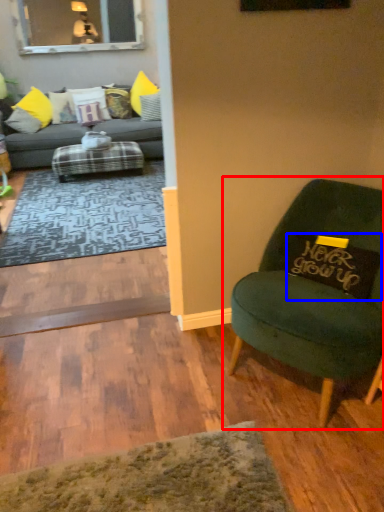
Question: Which object appears farthest to the camera in this image, chair (highlighted by a red box) or pillow (highlighted by a blue box)?

Choices:
 (A) chair
 (B) pillow

Answer: (B)